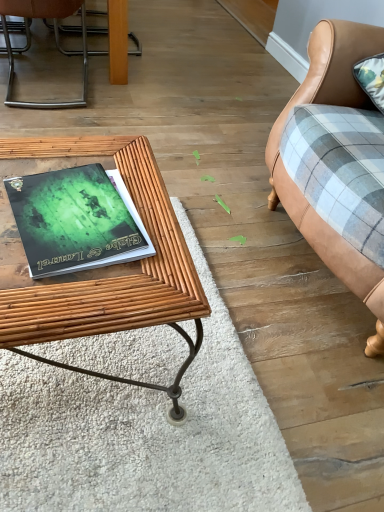
Find the location of a particular element. This screenshot has width=384, height=512. free space above green matte book at center (from a real-world perspective) is located at coordinates (131, 409).